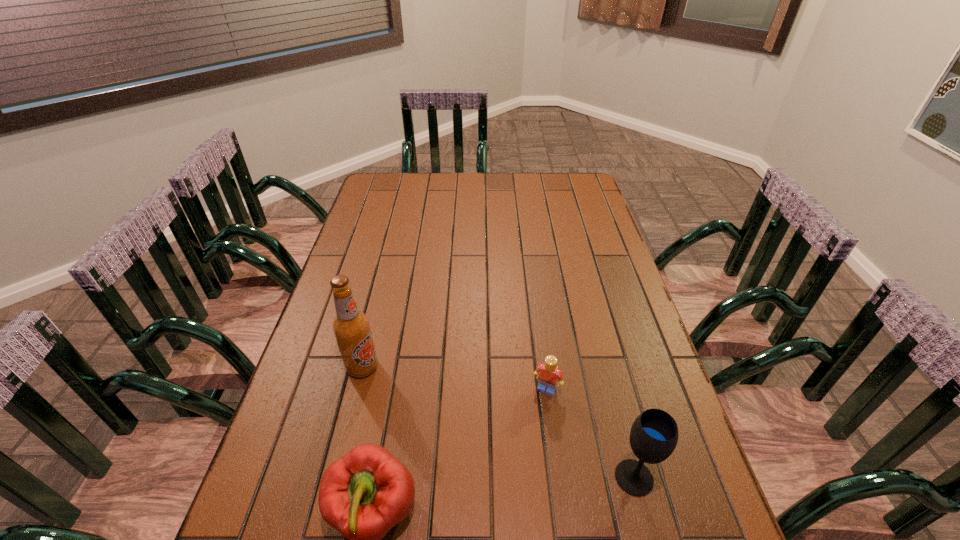
Locate an element on the screen. Image resolution: width=960 pixels, height=540 pixels. free region at the far right corner of the desktop is located at coordinates (550, 173).

Locate an element on the screen. The height and width of the screenshot is (540, 960). vacant region between the second object from right to left and the wineglass is located at coordinates (590, 433).

The width and height of the screenshot is (960, 540). Identify the location of unoccupied position between the second object from right to left and the third shortest object. (590, 433).

The height and width of the screenshot is (540, 960). Find the location of `free point between the second tallest object and the beer bottle`. free point between the second tallest object and the beer bottle is located at coordinates (498, 422).

Locate an element on the screen. free space between the wineglass and the tallest object is located at coordinates 498,422.

Where is `empty space that is in between the second object from right to left and the beer bottle`? Image resolution: width=960 pixels, height=540 pixels. empty space that is in between the second object from right to left and the beer bottle is located at coordinates (454, 378).

The image size is (960, 540). What are the coordinates of `empty space between the beer bottle and the wineglass` in the screenshot? It's located at (498, 422).

Find the location of `empty space between the second tallest object and the shortest object`. empty space between the second tallest object and the shortest object is located at coordinates (590, 433).

This screenshot has width=960, height=540. In order to click on vacant point located between the third shortest object and the tallest object in this screenshot , I will do `click(498, 422)`.

Select which object is the third closest to the shortest object. Please provide its 2D coordinates. Your answer should be formatted as a tuple, i.e. [(x, y)], where the tuple contains the x and y coordinates of a point satisfying the conditions above.

[(351, 327)]